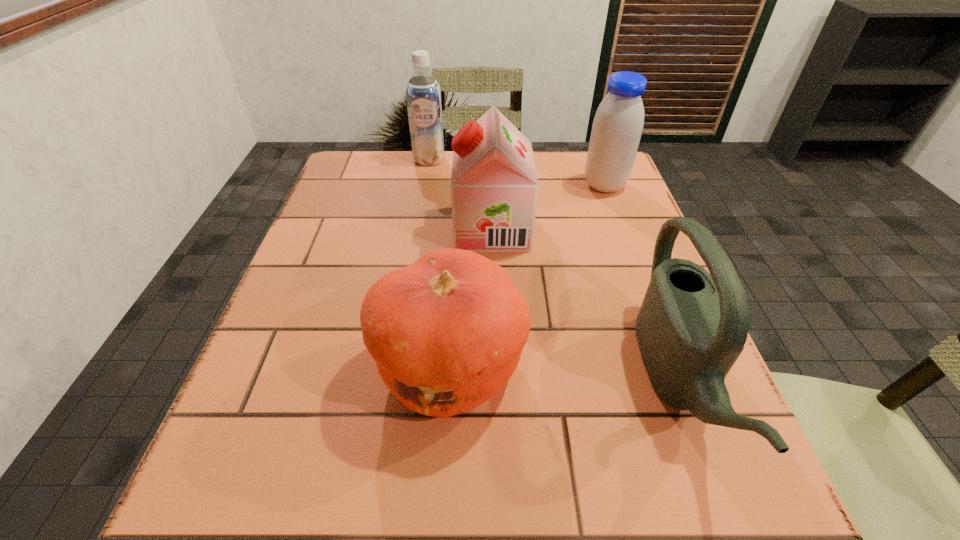
Image resolution: width=960 pixels, height=540 pixels. Find the location of `vacant space positioned with the cap open on the third nearest object`. vacant space positioned with the cap open on the third nearest object is located at coordinates (412, 228).

Find the location of a particular element. The height and width of the screenshot is (540, 960). free region located 0.070m with the cap open on the third nearest object is located at coordinates (425, 228).

The image size is (960, 540). I want to click on vacant area located with the cap open on the third nearest object, so click(x=386, y=228).

Image resolution: width=960 pixels, height=540 pixels. Find the location of `free space located 0.210m on the spout of the watering can`. free space located 0.210m on the spout of the watering can is located at coordinates (518, 380).

Find the location of `vacant space situated 0.260m on the spout of the watering can`. vacant space situated 0.260m on the spout of the watering can is located at coordinates (488, 380).

This screenshot has width=960, height=540. In order to click on free space located on the spout of the watering can in this screenshot , I will do `click(566, 380)`.

The width and height of the screenshot is (960, 540). I want to click on vacant space located on the left of the pumpkin, so click(x=257, y=368).

The width and height of the screenshot is (960, 540). Find the location of `object at the near edge`. object at the near edge is located at coordinates (692, 326).

You are a GUI agent. You are given a task and a screenshot of the screen. Output one action in this format:
    pyautogui.click(x=<x>, y=<y>)
    Task: Click on the soya milk that is at the right edge
    The width and height of the screenshot is (960, 540).
    Given the screenshot: What is the action you would take?
    pyautogui.click(x=618, y=123)

This screenshot has height=540, width=960. Identify the location of watering can located at the right edge. (692, 326).